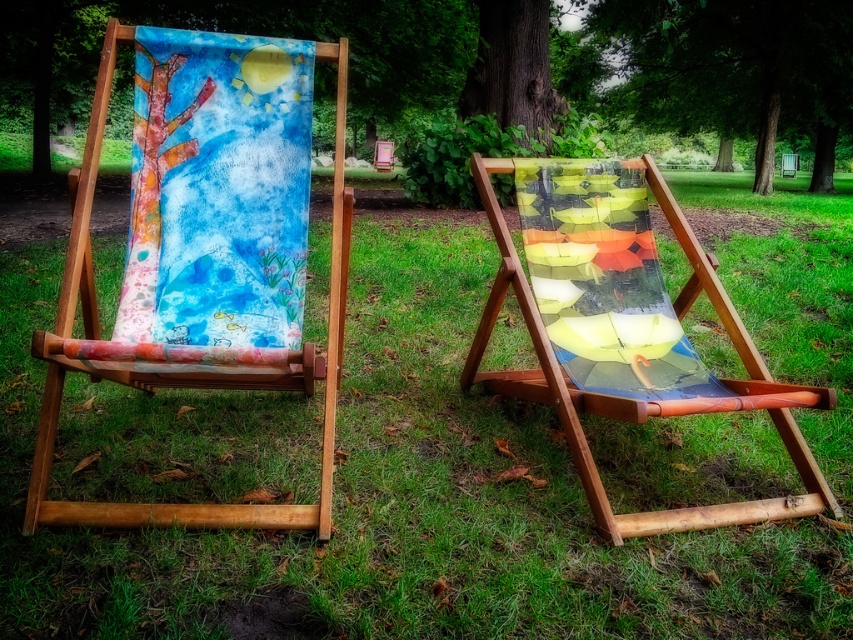
Question: Where is watercolor canvas at upper center located in relation to smooth bark tree at center in the image?

Choices:
 (A) above
 (B) below

Answer: (A)

Question: Which point appears closest to the camera in this image?

Choices:
 (A) (244, 282)
 (B) (360, 26)
 (C) (496, 116)

Answer: (A)

Question: Can you confirm if green leafy tree at upper center is positioned to the left of smooth bark tree at center?

Choices:
 (A) no
 (B) yes

Answer: (A)

Question: Which object is closer to the camera taking this photo?

Choices:
 (A) matte fabric beach chair at left
 (B) green grass at center
 (C) smooth bark tree at center
 (D) translucent umbrella-patterned fabric at center

Answer: (B)

Question: Which of these objects is positioned farthest from the matte fabric beach chair at left?

Choices:
 (A) translucent umbrella-patterned fabric at center
 (B) green grass at center
 (C) smooth bark tree at center
 (D) watercolor canvas at upper center

Answer: (D)

Question: Does watercolor canvas at upper center have a lesser width compared to smooth bark tree at center?

Choices:
 (A) no
 (B) yes

Answer: (A)